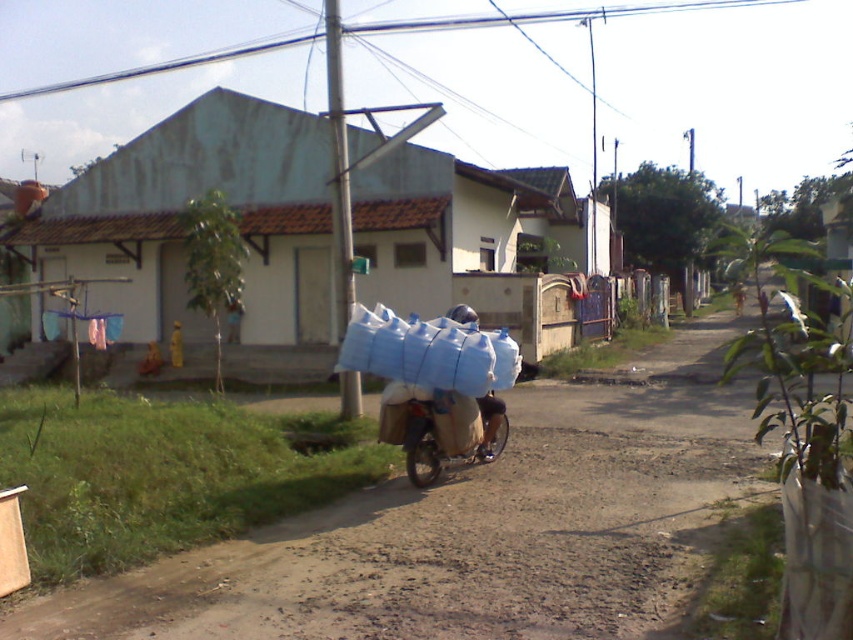
Who is positioned more to the right, brown dirt track at center or blue fabric bag at center?

blue fabric bag at center

Does brown dirt track at center appear on the left side of blue fabric bag at center?

Indeed, brown dirt track at center is positioned on the left side of blue fabric bag at center.

Locate an element on the screen. The image size is (853, 640). brown dirt track at center is located at coordinates (476, 531).